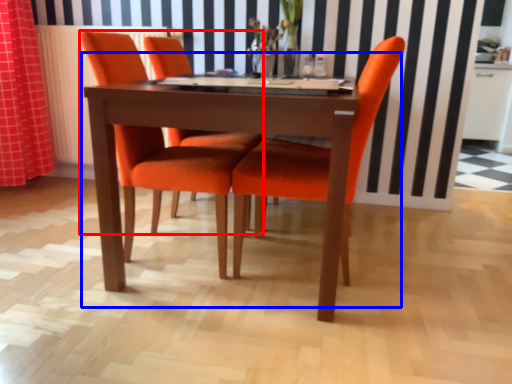
Question: Which object appears closest to the camera in this image, chair (highlighted by a red box) or kitchen & dining room table (highlighted by a blue box)?

Choices:
 (A) chair
 (B) kitchen & dining room table

Answer: (B)